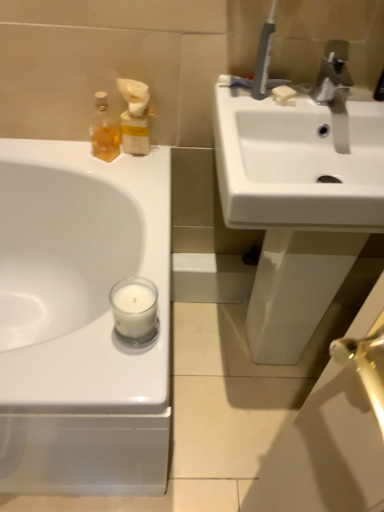
At what (x,y) coordinates should I click in order to perform the action: click on vacant space situated on the left part of translucent glass bottle at upper left. Please return your answer as a coordinate pair (x, y). The width and height of the screenshot is (384, 512). Looking at the image, I should click on (61, 152).